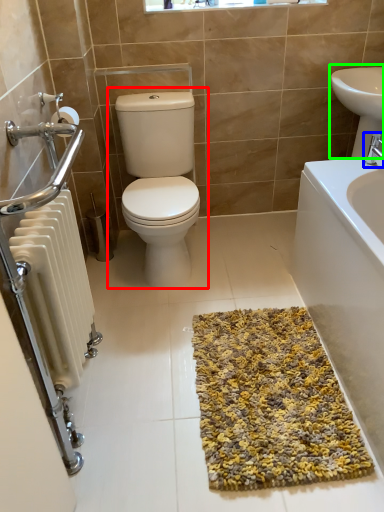
Question: Based on their relative distances, which object is farther from toilet (highlighted by a red box)? Choose from tap (highlighted by a blue box) and sink (highlighted by a green box).

Choices:
 (A) tap
 (B) sink

Answer: (A)